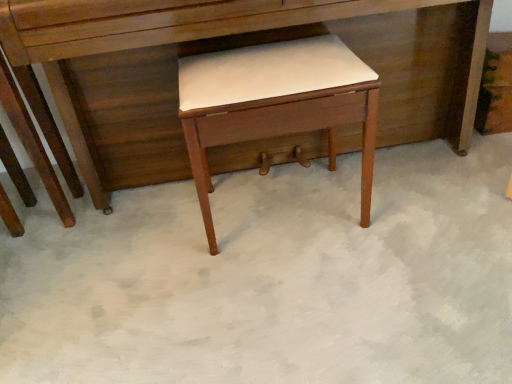
Question: Is matte wood desk at center positioned before matte wood stool at center?

Choices:
 (A) no
 (B) yes

Answer: (B)

Question: Would you say matte wood desk at center is a long distance from matte wood stool at center?

Choices:
 (A) no
 (B) yes

Answer: (A)

Question: From the image's perspective, is matte wood desk at center on top of matte wood stool at center?

Choices:
 (A) no
 (B) yes

Answer: (B)

Question: Is matte wood desk at center at the right side of matte wood stool at center?

Choices:
 (A) no
 (B) yes

Answer: (A)

Question: Does matte wood desk at center have a smaller size compared to matte wood stool at center?

Choices:
 (A) yes
 (B) no

Answer: (B)

Question: Considering the relative sizes of matte wood desk at center and matte wood stool at center in the image provided, is matte wood desk at center shorter than matte wood stool at center?

Choices:
 (A) no
 (B) yes

Answer: (A)

Question: Can you confirm if matte wood stool at center is shorter than matte wood desk at center?

Choices:
 (A) no
 (B) yes

Answer: (B)

Question: From the image's perspective, is matte wood stool at center above matte wood desk at center?

Choices:
 (A) yes
 (B) no

Answer: (B)

Question: Is matte wood stool at center positioned beyond the bounds of matte wood desk at center?

Choices:
 (A) yes
 (B) no

Answer: (B)

Question: Is matte wood stool at center further to camera compared to matte wood desk at center?

Choices:
 (A) yes
 (B) no

Answer: (A)

Question: Is matte wood stool at center thinner than matte wood desk at center?

Choices:
 (A) yes
 (B) no

Answer: (A)

Question: Is matte wood stool at center smaller than matte wood desk at center?

Choices:
 (A) no
 (B) yes

Answer: (B)

Question: Does point (51, 135) appear closer or farther from the camera than point (283, 92)?

Choices:
 (A) farther
 (B) closer

Answer: (A)